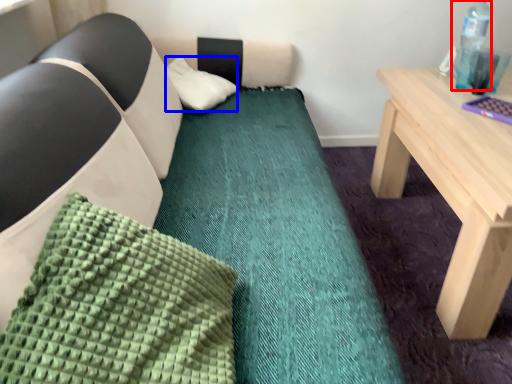
Question: Which of the following is the closest to the observer, bottle (highlighted by a red box) or pillow (highlighted by a blue box)?

Choices:
 (A) bottle
 (B) pillow

Answer: (A)